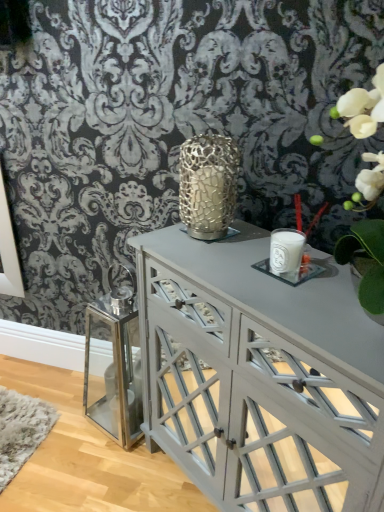
Locate an element on the screen. The width and height of the screenshot is (384, 512). free point behind white glass candle at center, marked as the 2th candle holder in a top-to-bottom arrangement is located at coordinates (253, 248).